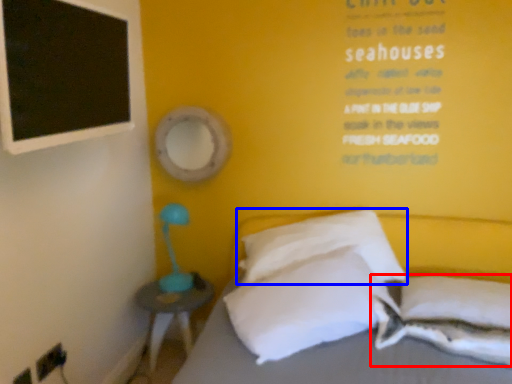
Question: Among these objects, which one is nearest to the camera, pillow (highlighted by a red box) or pillow (highlighted by a blue box)?

Choices:
 (A) pillow
 (B) pillow

Answer: (A)